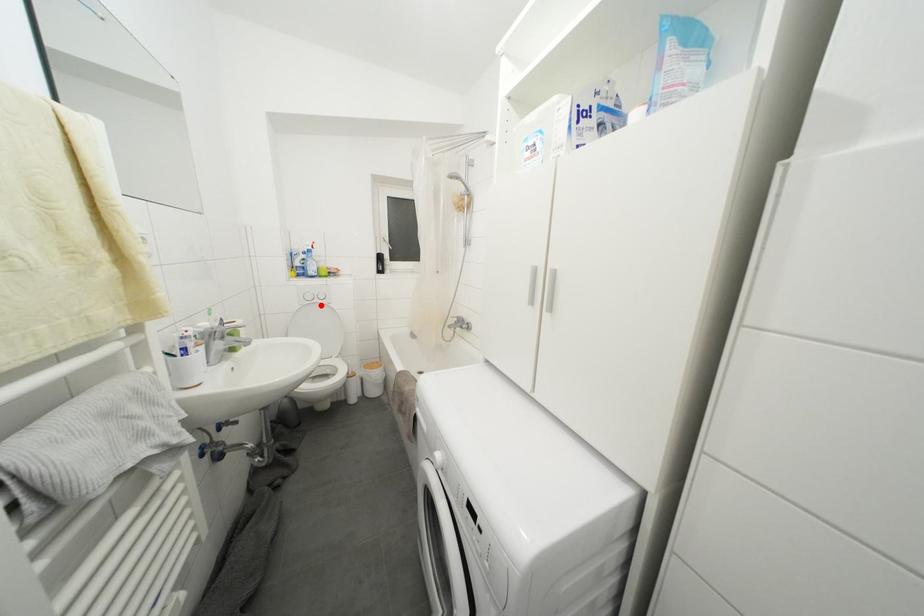
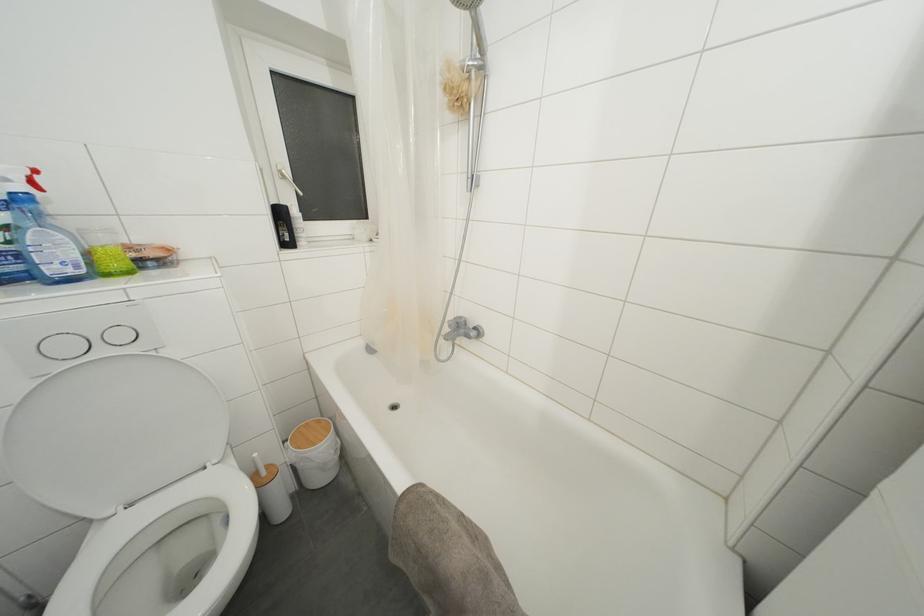
Find the pixel in the second image that matches the highlighted location in the first image.

(106, 357)